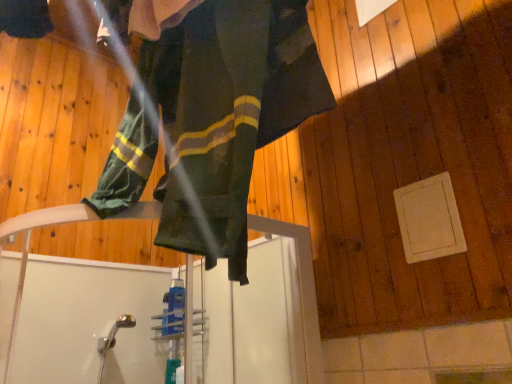
Question: Can you confirm if white matte panel at lower right is smaller than green fabric pants at center?

Choices:
 (A) no
 (B) yes

Answer: (B)

Question: Is white matte panel at lower right further to camera compared to green fabric pants at center?

Choices:
 (A) yes
 (B) no

Answer: (A)

Question: Can you confirm if white matte panel at lower right is taller than green fabric pants at center?

Choices:
 (A) yes
 (B) no

Answer: (B)

Question: Is green fabric pants at center inside white matte panel at lower right?

Choices:
 (A) yes
 (B) no

Answer: (B)

Question: Is white matte panel at lower right outside green fabric pants at center?

Choices:
 (A) no
 (B) yes

Answer: (B)

Question: From a real-world perspective, is white matte panel at lower right located beneath green fabric pants at center?

Choices:
 (A) yes
 (B) no

Answer: (A)

Question: From a real-world perspective, is green fabric pants at center under white matte panel at lower right?

Choices:
 (A) no
 (B) yes

Answer: (A)

Question: Can you confirm if green fabric pants at center is positioned to the right of white matte panel at lower right?

Choices:
 (A) no
 (B) yes

Answer: (A)

Question: Does green fabric pants at center have a larger size compared to white matte panel at lower right?

Choices:
 (A) yes
 (B) no

Answer: (A)

Question: Could white matte panel at lower right be considered to be inside green fabric pants at center?

Choices:
 (A) no
 (B) yes

Answer: (A)

Question: From a real-world perspective, is green fabric pants at center on white matte panel at lower right?

Choices:
 (A) yes
 (B) no

Answer: (A)

Question: Are green fabric pants at center and white matte panel at lower right beside each other?

Choices:
 (A) no
 (B) yes

Answer: (A)

Question: Which is correct: white matte panel at lower right is inside green fabric pants at center, or outside of it?

Choices:
 (A) inside
 (B) outside

Answer: (B)